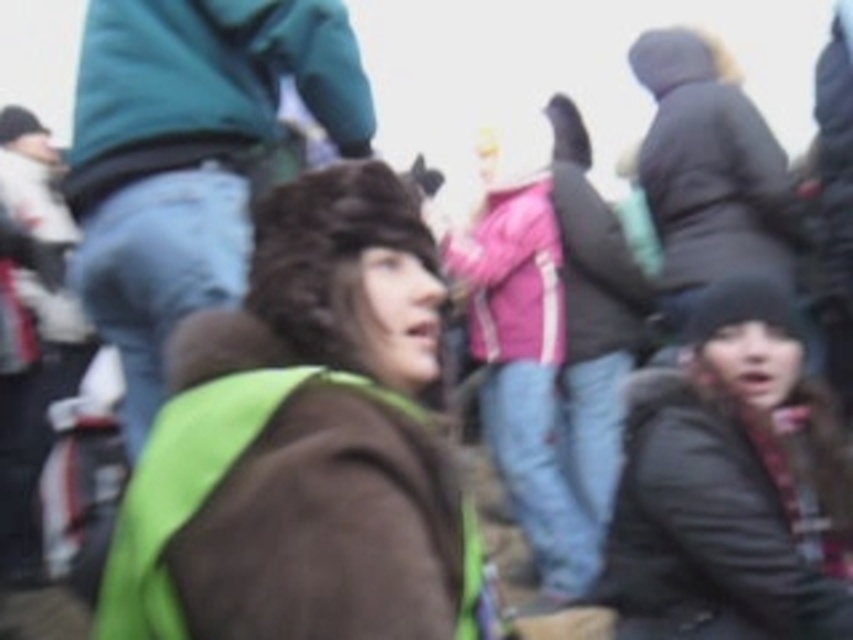
What do you see at coordinates (512, 276) in the screenshot? I see `matte pink jacket at center` at bounding box center [512, 276].

Does matte pink jacket at center have a lesser height compared to pink fabric jacket at upper center?

Yes, matte pink jacket at center is shorter than pink fabric jacket at upper center.

The image size is (853, 640). Describe the element at coordinates (512, 276) in the screenshot. I see `matte pink jacket at center` at that location.

Find the location of a particular element. The image size is (853, 640). matte pink jacket at center is located at coordinates (512, 276).

Can you confirm if dark brown leather jacket at lower right is smaller than pink fabric jacket at upper center?

Yes.

Is dark brown leather jacket at lower right bigger than pink fabric jacket at upper center?

Actually, dark brown leather jacket at lower right might be smaller than pink fabric jacket at upper center.

Which is behind, point (656, 497) or point (616, 346)?

Point (616, 346)

This screenshot has width=853, height=640. Identify the location of dark brown leather jacket at lower right. (705, 529).

Is dark brown leather jacket at lower right to the left of matte pink jacket at center from the viewer's perspective?

Incorrect, dark brown leather jacket at lower right is not on the left side of matte pink jacket at center.

This screenshot has width=853, height=640. Find the location of `dark brown leather jacket at lower right`. dark brown leather jacket at lower right is located at coordinates (705, 529).

This screenshot has height=640, width=853. What do you see at coordinates (705, 529) in the screenshot?
I see `dark brown leather jacket at lower right` at bounding box center [705, 529].

The height and width of the screenshot is (640, 853). What are the coordinates of `dark brown leather jacket at lower right` in the screenshot? It's located at (705, 529).